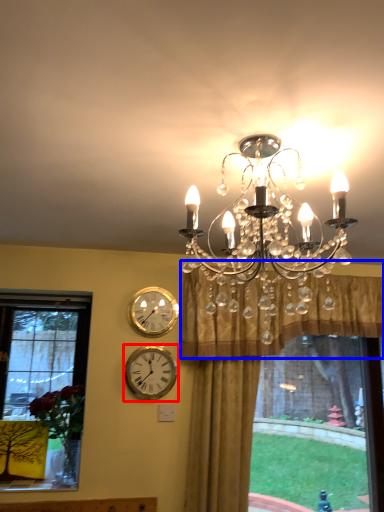
Question: Which of the following is the farthest to the observer, wall clock (highlighted by a red box) or curtain (highlighted by a blue box)?

Choices:
 (A) wall clock
 (B) curtain

Answer: (A)